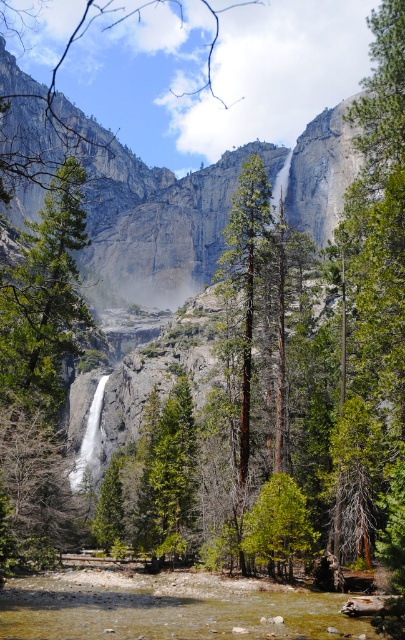
Is gray rock face at center bigger than clear water at lower center?

Yes, gray rock face at center is bigger than clear water at lower center.

Which is below, gray rock face at center or clear water at lower center?

clear water at lower center

Is point (302, 160) in front of point (80, 630)?

That is False.

Find the location of a particular element. gray rock face at center is located at coordinates (204, 208).

Who is lower down, green matte tree at left or green matte tree at center?

green matte tree at center

Can you confirm if green matte tree at left is positioned to the left of green matte tree at center?

Yes, green matte tree at left is to the left of green matte tree at center.

The height and width of the screenshot is (640, 405). Identify the location of green matte tree at left. 44,298.

Does point (108, 230) come farther from viewer compared to point (242, 545)?

Yes.

At what (x,y) coordinates should I click in order to perform the action: click on gray rock face at center. Please return your answer as a coordinate pair (x, y). The height and width of the screenshot is (640, 405). Looking at the image, I should click on (204, 208).